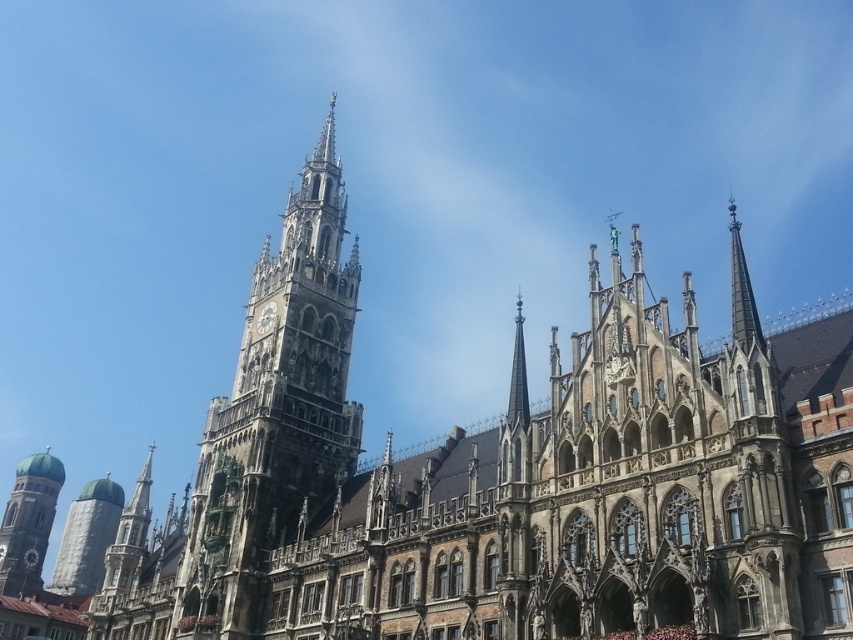
Looking at this image, you are an architect designing a new city plaza and need to place a new statue between the green domed tower at lower left and the silver metallic tower at lower left. Based on their widths, which tower should the statue be closer to?

The green domed tower at lower left might be wider than silver metallic tower at lower left, so the statue should be placed closer to the green domed tower at lower left to maintain visual balance between the two structures.

You are standing in front of the historic building and want to take a photo that captures both the point at coordinates point [0,557] and point [90,548]. Since you want to ensure both points are in focus, which point should you focus on to maximize the depth of field?

You should focus on point [90,548] because it is farther from the camera than point [0,557]. Focusing on the farther point will ensure both points are within the depth of field.

You are an architect evaluating the building design. Based on the image, which of the two towers, the stone gothic tower at center or the green domed tower at lower left, is taller?

The stone gothic tower at center is taller than the green domed tower at lower left according to the description.